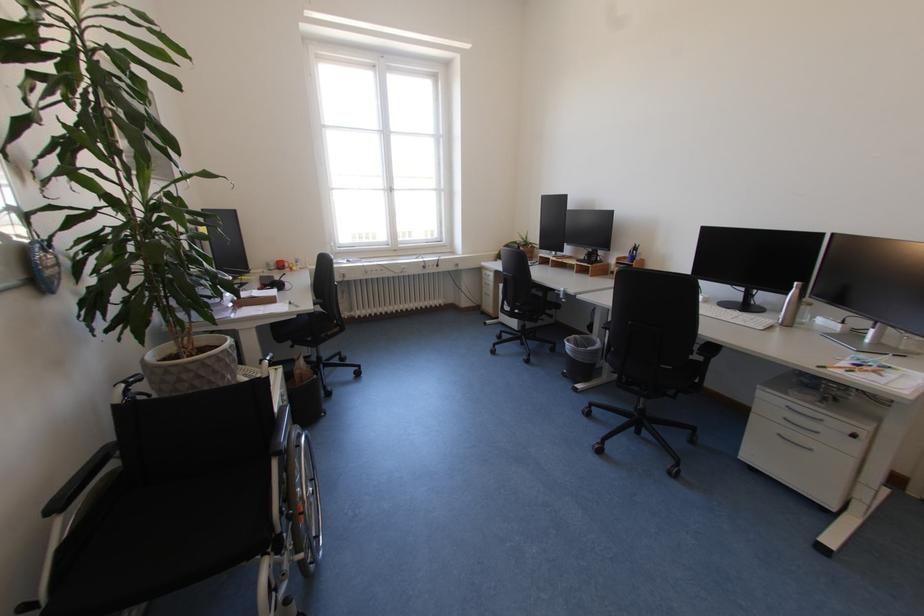
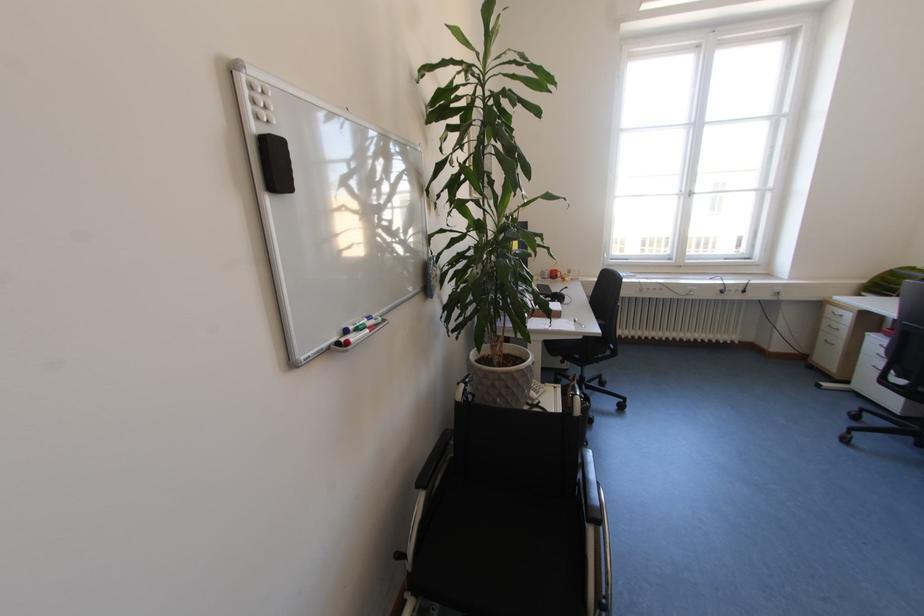
The point at (110,448) is marked in the first image. Where is the corresponding point in the second image?

(451, 435)